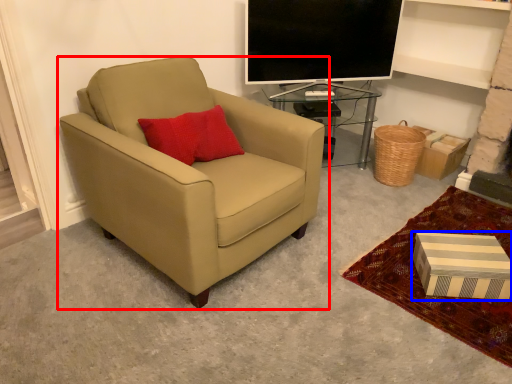
Question: Which point is further to the camera, chair (highlighted by a red box) or box (highlighted by a blue box)?

Choices:
 (A) chair
 (B) box

Answer: (B)